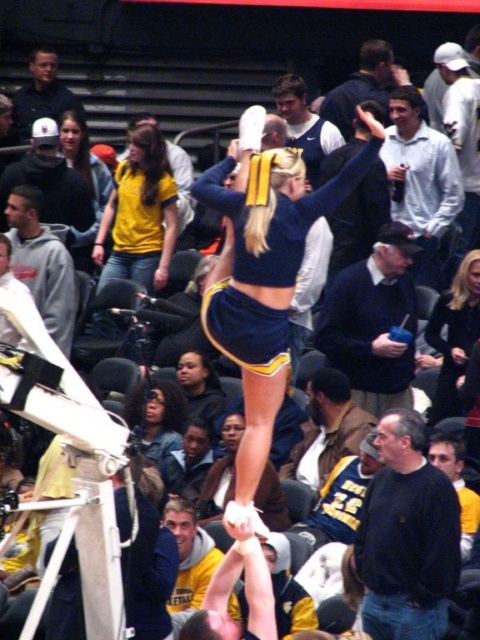
Question: Is yellow matte shirt at center smaller than dark brown hair at center?

Choices:
 (A) no
 (B) yes

Answer: (A)

Question: In this image, where is dark brown hair at center located relative to dark blue hoodie at center?

Choices:
 (A) below
 (B) above

Answer: (A)

Question: Based on their relative distances, which object is farther from the black leather jacket at lower right?

Choices:
 (A) yellow matte shirt at center
 (B) matte blue uniform at center

Answer: (A)

Question: Which object appears farthest from the camera in this image?

Choices:
 (A) dark blue hoodie at center
 (B) yellow matte shirt at center
 (C) dark brown hair at center
 (D) black leather jacket at lower right

Answer: (B)

Question: In this image, where is dark brown hair at center located relative to dark blue hoodie at center?

Choices:
 (A) above
 (B) below

Answer: (B)

Question: Which object is positioned farthest from the matte blue uniform at center?

Choices:
 (A) black leather jacket at lower right
 (B) yellow matte shirt at center
 (C) dark brown hair at center

Answer: (A)